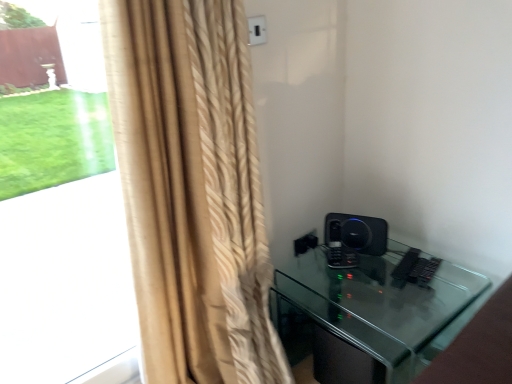
Question: From the image's perspective, is beige textured curtain at left located above or below black matte speaker at right?

Choices:
 (A) above
 (B) below

Answer: (A)

Question: From their relative heights in the image, would you say beige textured curtain at left is taller or shorter than black matte speaker at right?

Choices:
 (A) tall
 (B) short

Answer: (A)

Question: Which is farther from the beige textured curtain at left?

Choices:
 (A) black matte speaker at right
 (B) beige textured curtain at left
 (C) black glass table at lower right

Answer: (B)

Question: Estimate the real-world distances between objects in this image. Which object is farther from the black glass table at lower right?

Choices:
 (A) beige textured curtain at left
 (B) black matte speaker at right
 (C) beige textured curtain at left

Answer: (C)